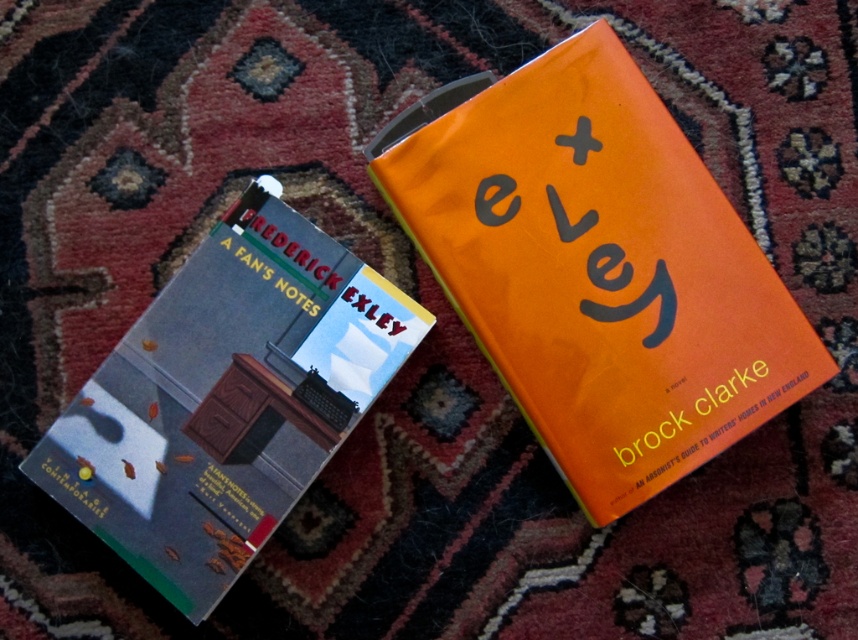
Question: Does orange matte book at upper right appear on the right side of hardcover book at left?

Choices:
 (A) no
 (B) yes

Answer: (B)

Question: Can you confirm if orange matte book at upper right is positioned above hardcover book at left?

Choices:
 (A) no
 (B) yes

Answer: (B)

Question: Is orange matte book at upper right further to the viewer compared to hardcover book at left?

Choices:
 (A) yes
 (B) no

Answer: (A)

Question: Which object appears farthest from the camera in this image?

Choices:
 (A) orange matte book at upper right
 (B) hardcover book at left

Answer: (A)

Question: Which object appears closest to the camera in this image?

Choices:
 (A) orange matte book at upper right
 (B) hardcover book at left

Answer: (B)